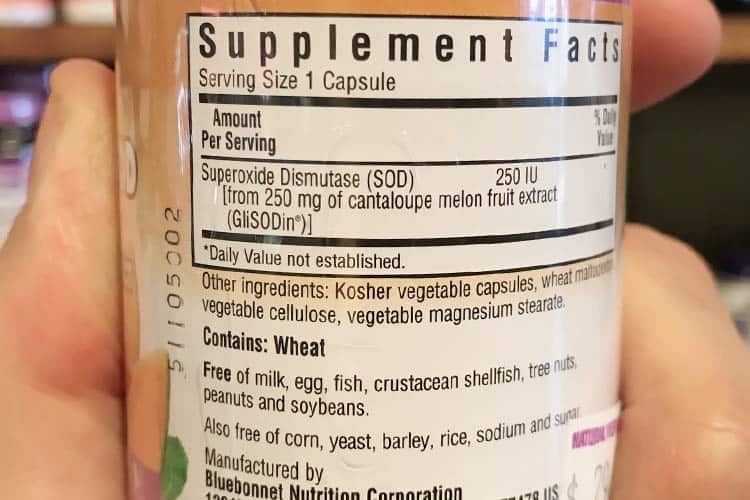
Locate an element on the screen. shelves is located at coordinates [x=37, y=38].